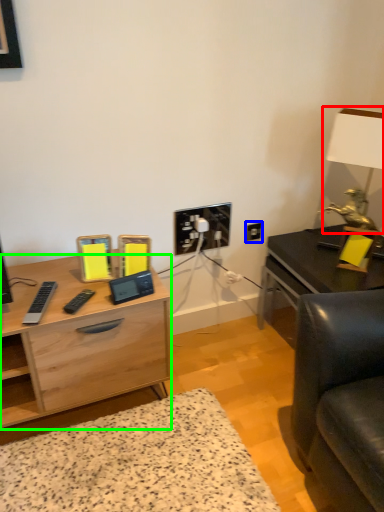
Question: Considering the real-world distances, which object is farthest from table lamp (highlighted by a red box)? electric outlet (highlighted by a blue box) or desk (highlighted by a green box)?

Choices:
 (A) electric outlet
 (B) desk

Answer: (B)